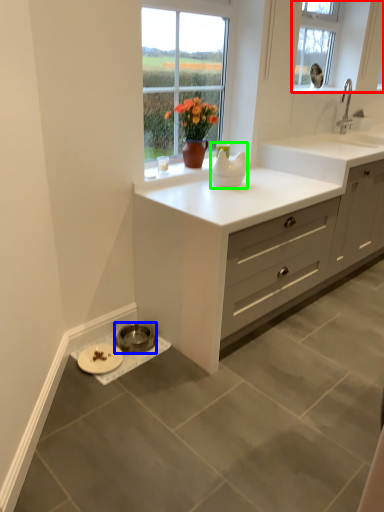
Question: Considering the real-world distances, which object is farthest from window (highlighted by a red box)? appliance (highlighted by a blue box) or appliance (highlighted by a green box)?

Choices:
 (A) appliance
 (B) appliance

Answer: (A)